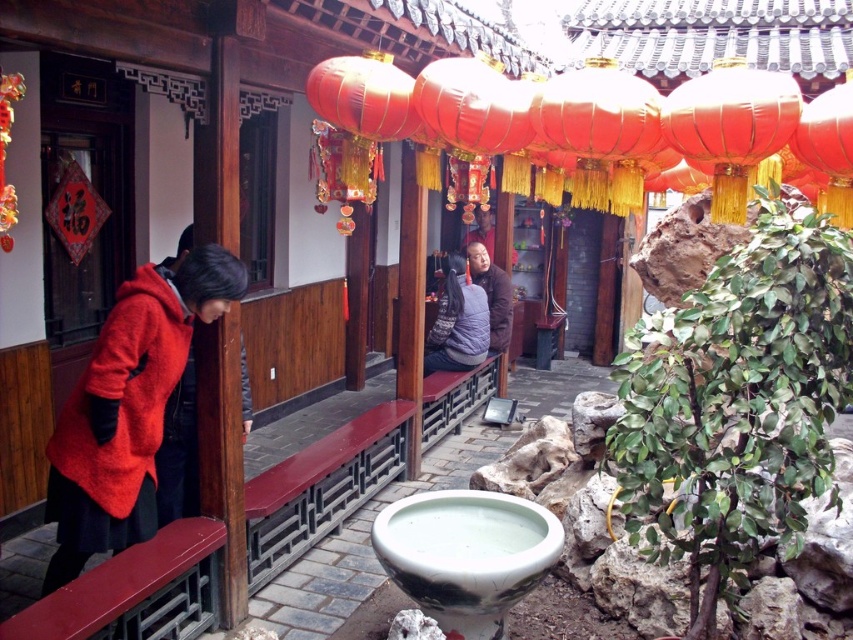
Question: Which point is farther to the camera?

Choices:
 (A) shiny red lantern at upper center
 (B) matte red coat at left

Answer: (B)

Question: Does shiny red lantern at upper center lie behind shiny red lantern at upper right?

Choices:
 (A) yes
 (B) no

Answer: (B)

Question: Does shiny red lantern at upper center appear on the right side of shiny red lantern at upper right?

Choices:
 (A) no
 (B) yes

Answer: (A)

Question: Considering the relative positions of matte red coat at left and knitted sweater at center in the image provided, where is matte red coat at left located with respect to knitted sweater at center?

Choices:
 (A) right
 (B) left

Answer: (B)

Question: Which point appears farthest from the camera in this image?

Choices:
 (A) (743, 193)
 (B) (105, 440)
 (C) (465, 340)

Answer: (C)

Question: Which point is closer to the camera?

Choices:
 (A) shiny red lantern at upper right
 (B) knitted sweater at center

Answer: (A)